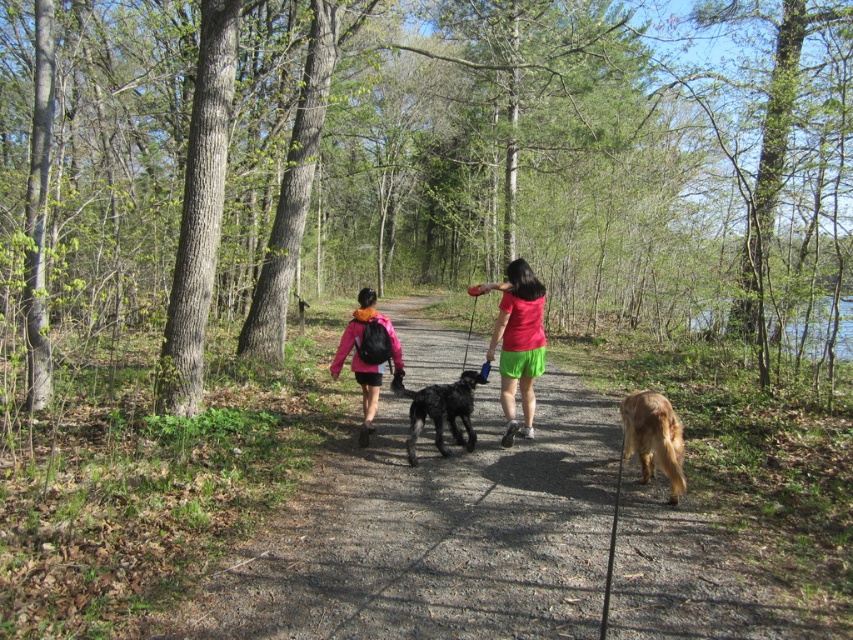
You are standing on the forest path and want to walk towards the brown dirt path at center. Which direction should you face to avoid stepping on the shiny black dog at center?

The brown dirt path at center is to the right of the shiny black dog at center, so you should face towards the right direction to avoid stepping on the shiny black dog at center.